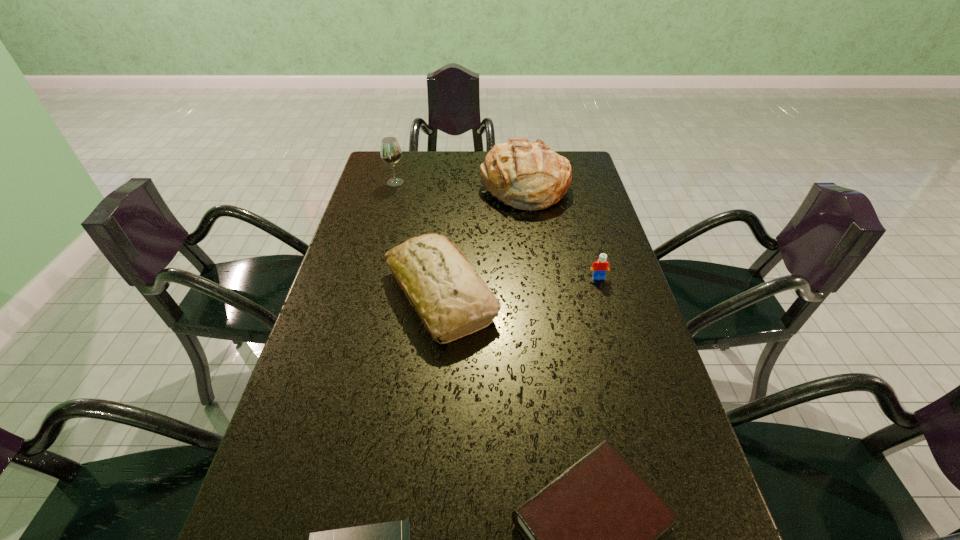
In order to click on the farther bread in this screenshot , I will do `click(529, 176)`.

Where is `wineglass`? This screenshot has width=960, height=540. wineglass is located at coordinates (390, 151).

Locate an element on the screen. the nearer bread is located at coordinates (451, 300).

Where is `the shorter bread`? the shorter bread is located at coordinates (451, 300).

Identify the location of the third shortest object. Image resolution: width=960 pixels, height=540 pixels. (601, 266).

Find the location of a particular element. Image resolution: width=960 pixels, height=540 pixels. free space located 0.210m on the front of the taller bread is located at coordinates tap(534, 255).

Identify the location of vacant point located 0.400m on the right of the wineglass. (516, 183).

Where is `vacant space located on the front of the shorter bread`? This screenshot has width=960, height=540. vacant space located on the front of the shorter bread is located at coordinates (432, 378).

The height and width of the screenshot is (540, 960). I want to click on vacant space situated 0.230m on the face of the third shortest object, so click(618, 346).

Locate an element on the screen. bread at the far edge is located at coordinates (529, 176).